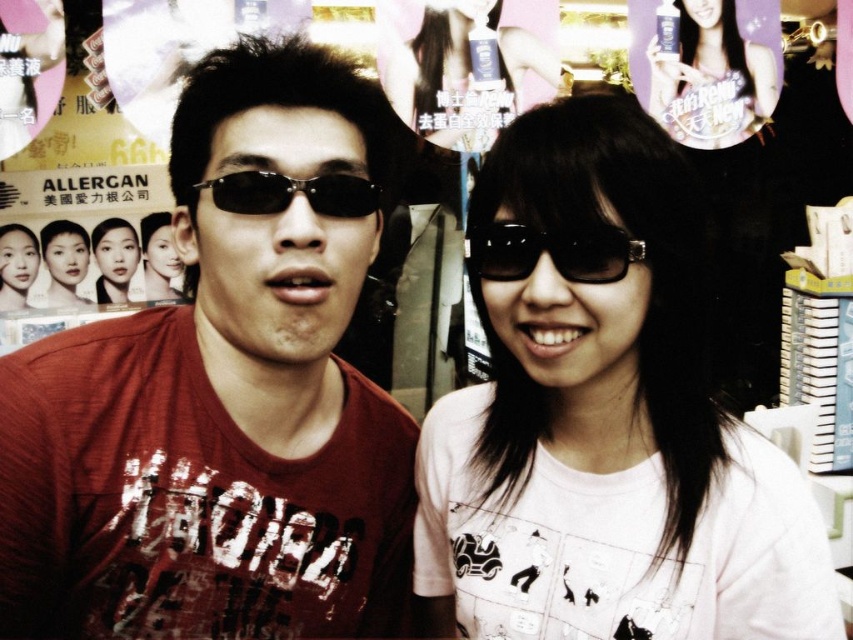
You are a photographer trying to capture the white matte shirt at center in the image. The camera is set to focus on the point at coordinates (602, 417). Will this point be on the white matte shirt at center?

Yes, the point at coordinates (602, 417) indicates the white matte shirt at center, so the camera will focus on it.

You are a photographer setting up a shoot in this scene. You want to capture a clear shot of both the matte black hair at upper center and the matte white bottle at upper right without any obstruction. Based on their positions, which object should you adjust to avoid blocking the other?

The matte black hair at upper center is in front of the matte white bottle at upper right, so you should adjust the matte black hair at upper center to move it out of the way to avoid blocking the matte white bottle at upper right.

You are standing in the retail store and want to take a photo of both the point at (x=544, y=156) and the point at (x=0, y=234). Which point should you focus on first to ensure both are in focus?

You should focus on the point at (x=544, y=156) first because it is closer to the camera than the point at (x=0, y=234). This ensures the closer point is in focus, and the farther point will also be within the depth of field.